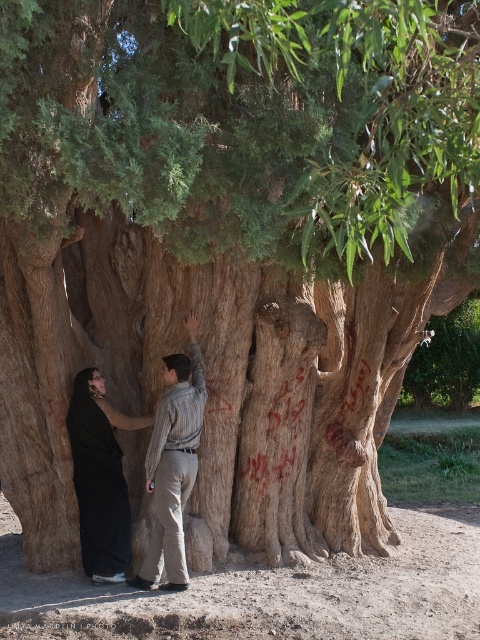
Question: Which point is farther to the camera?

Choices:
 (A) (192, 400)
 (B) (90, 481)

Answer: (B)

Question: Can you confirm if striped shirt at center is wider than black matte dress at left?

Choices:
 (A) no
 (B) yes

Answer: (A)

Question: In this image, where is striped shirt at center located relative to black matte dress at left?

Choices:
 (A) left
 (B) right

Answer: (B)

Question: Does striped shirt at center appear on the right side of black matte dress at left?

Choices:
 (A) yes
 (B) no

Answer: (A)